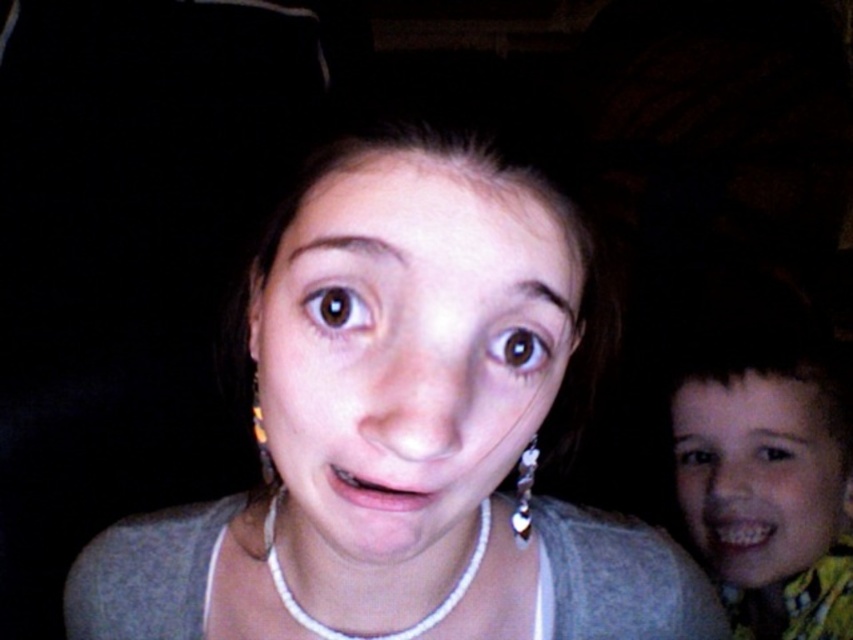
Question: Considering the real-world distances, which object is farthest from the brown glossy eye at upper center?

Choices:
 (A) brown shiny eye at center
 (B) gray fabric at center
 (C) brown shiny eye at upper center
 (D) white pearl necklace at center

Answer: (C)

Question: Does yellow patterned shirt at right have a lesser width compared to yellow plastic earring at left?

Choices:
 (A) yes
 (B) no

Answer: (B)

Question: Is silver metallic earring at lower right to the right of yellow plastic earring at left from the viewer's perspective?

Choices:
 (A) yes
 (B) no

Answer: (A)

Question: Which point is closer to the camera?

Choices:
 (A) (694, 465)
 (B) (728, 524)

Answer: (B)

Question: Is gray fabric at center above brown shiny eye at upper center?

Choices:
 (A) no
 (B) yes

Answer: (B)

Question: Which point is farther to the camera?

Choices:
 (A) yellow patterned shirt at right
 (B) yellow plastic earring at left
 (C) silver metallic earring at lower right

Answer: (A)